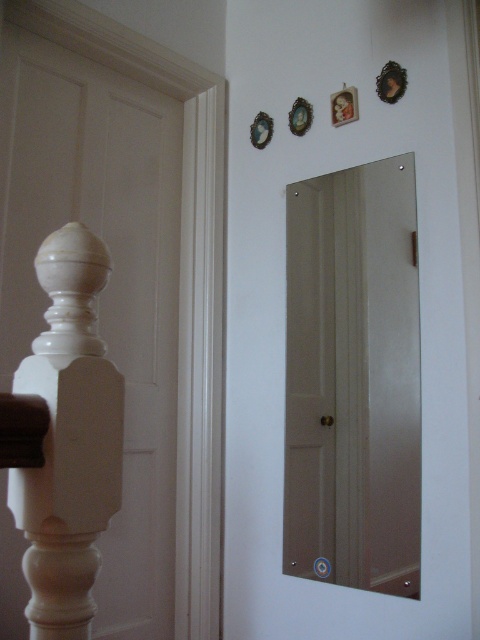
You are a painter who needs to decide which object to paint first. The white matte wooden door at left and the clear glass mirror at center are both in your view. Based on their sizes, which one should you choose if you want to start with the bigger one?

The white matte wooden door at left is larger in size than the clear glass mirror at center, so you should start painting the white matte wooden door at left first.

You are a painter holding a 1.5 meter wide canvas. You want to place it between the white matte wooden door at left and the white matte wooden post at left. Will the canvas fit in the space between them?

The distance between the white matte wooden door at left and the white matte wooden post at left is 1.41 meters. Since the canvas is 1.5 meters wide, it will not fit in the space between them.

You are trying to hang a new picture frame that is 1 meter wide. You want to place it between the clear glass mirror at center and the matte white balustrade at left. Based on their widths, will there be enough space for the frame?

The clear glass mirror at center might be wider than matte white balustrade at left, so there may not be enough space between them to fit a 1 meter wide picture frame. You should measure the actual distance first before hanging it.